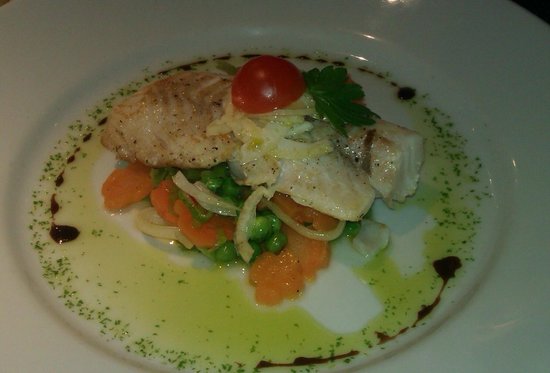
Locate an element on the screen. dinner plate is located at coordinates (123, 39).